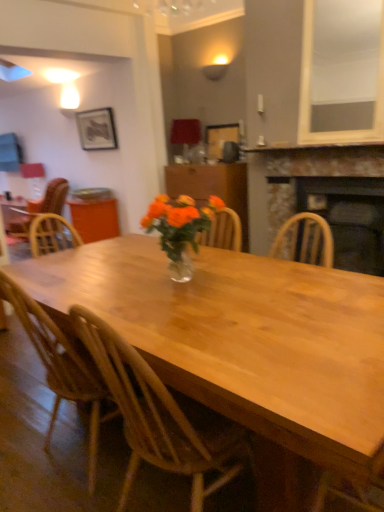
Question: Considering the relative sizes of black stone fireplace at center, which ranks as the second fireplace in top-to-bottom order, and wooden at left, which is counted as the 2th chair, starting from the back, in the image provided, is black stone fireplace at center, which ranks as the second fireplace in top-to-bottom order, bigger than wooden at left, which is counted as the 2th chair, starting from the back,?

Choices:
 (A) no
 (B) yes

Answer: (A)

Question: Are black stone fireplace at center, which is the 1th fireplace in bottom-to-top order, and wooden at left, which ranks as the 2th chair in left-to-right order, making contact?

Choices:
 (A) yes
 (B) no

Answer: (B)

Question: Is black stone fireplace at center, which is the 1th fireplace in bottom-to-top order, to the left of wooden at left, which is counted as the 2th chair, starting from the back, from the viewer's perspective?

Choices:
 (A) yes
 (B) no

Answer: (B)

Question: From a real-world perspective, is black stone fireplace at center, which is the 1th fireplace in bottom-to-top order, below wooden at left, which is the 2th chair in right-to-left order?

Choices:
 (A) no
 (B) yes

Answer: (A)

Question: From the image's perspective, is black stone fireplace at center, which ranks as the second fireplace in top-to-bottom order, beneath wooden at left, which is the 2th chair in right-to-left order?

Choices:
 (A) no
 (B) yes

Answer: (A)

Question: In terms of size, does wooden chair at left, which appears as the 3th chair when viewed from the right, appear bigger or smaller than black stone fireplace at center, which is the 1th fireplace in bottom-to-top order?

Choices:
 (A) big
 (B) small

Answer: (A)

Question: Visually, is wooden chair at left, which is the 3th chair from front to back, positioned to the left or to the right of black stone fireplace at center, which is the 1th fireplace in bottom-to-top order?

Choices:
 (A) left
 (B) right

Answer: (A)

Question: Considering their positions, is wooden chair at left, which is the 3th chair from front to back, located in front of or behind black stone fireplace at center, which is the 1th fireplace in bottom-to-top order?

Choices:
 (A) behind
 (B) front

Answer: (A)

Question: Is wooden chair at left, which is the 3th chair from front to back, wider or thinner than black stone fireplace at center, which is the 1th fireplace in bottom-to-top order?

Choices:
 (A) wide
 (B) thin

Answer: (A)

Question: From the image's perspective, relative to wooden cabinet at center, is wooden chair at left, which appears as the 3th chair when viewed from the right, above or below?

Choices:
 (A) below
 (B) above

Answer: (B)

Question: From a real-world perspective, is wooden chair at left, which is the 3th chair from front to back, above or below wooden cabinet at center?

Choices:
 (A) above
 (B) below

Answer: (B)

Question: Choose the correct answer: Is wooden chair at left, which appears as the 3th chair when viewed from the right, inside wooden cabinet at center or outside it?

Choices:
 (A) outside
 (B) inside

Answer: (A)

Question: Looking at their shapes, would you say wooden chair at left, arranged as the first chair when viewed from the back, is wider or thinner than wooden cabinet at center?

Choices:
 (A) wide
 (B) thin

Answer: (A)

Question: From the image's perspective, is translucent glass vase at center positioned above or below rustic stone fireplace at right, marked as the second fireplace in a bottom-to-top arrangement?

Choices:
 (A) below
 (B) above

Answer: (A)

Question: In terms of height, does translucent glass vase at center look taller or shorter compared to rustic stone fireplace at right, which ranks as the 1th fireplace in top-to-bottom order?

Choices:
 (A) short
 (B) tall

Answer: (A)